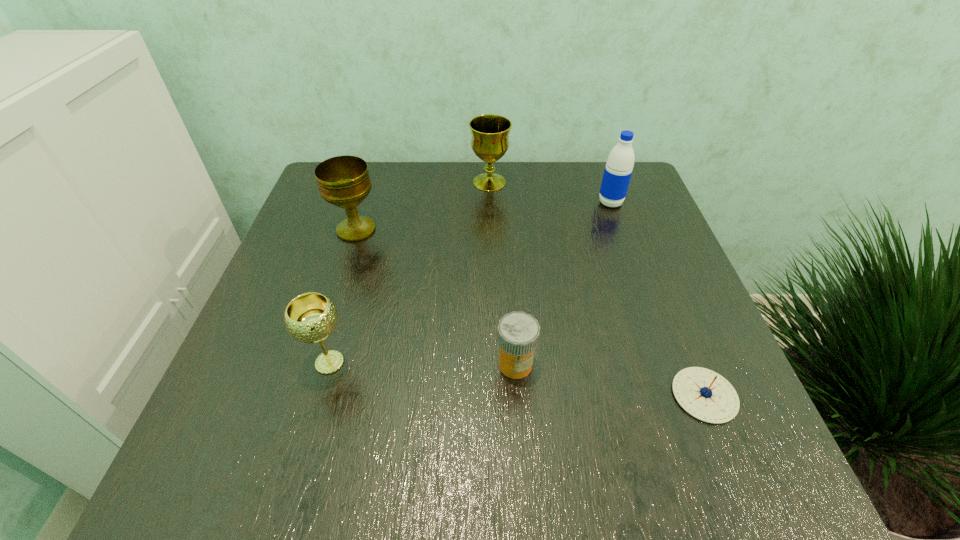
Image resolution: width=960 pixels, height=540 pixels. I want to click on free space located 0.070m on the back of the nearest chalice, so click(x=344, y=314).

The width and height of the screenshot is (960, 540). In order to click on vacant space located 0.370m on the back of the compass in this screenshot , I will do `click(639, 232)`.

What are the coordinates of `water bottle situated at the far edge` in the screenshot? It's located at (619, 166).

Find the location of a particular element. The height and width of the screenshot is (540, 960). water bottle at the right edge is located at coordinates (619, 166).

Identify the location of compass that is at the right edge. The width and height of the screenshot is (960, 540). (704, 394).

Where is `object that is at the far left corner`? The image size is (960, 540). object that is at the far left corner is located at coordinates (343, 181).

Image resolution: width=960 pixels, height=540 pixels. Find the location of `object located in the far right corner section of the desktop`. object located in the far right corner section of the desktop is located at coordinates (619, 166).

This screenshot has height=540, width=960. In the image, there is a desktop. In order to click on vacant space at the near edge in this screenshot , I will do `click(627, 493)`.

Locate an element on the screen. The height and width of the screenshot is (540, 960). vacant space at the left edge is located at coordinates (317, 237).

This screenshot has height=540, width=960. I want to click on free space at the right edge of the desktop, so click(665, 266).